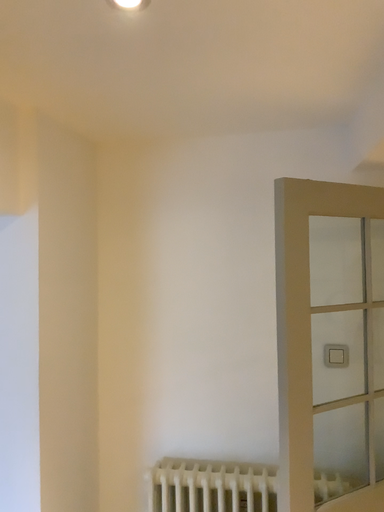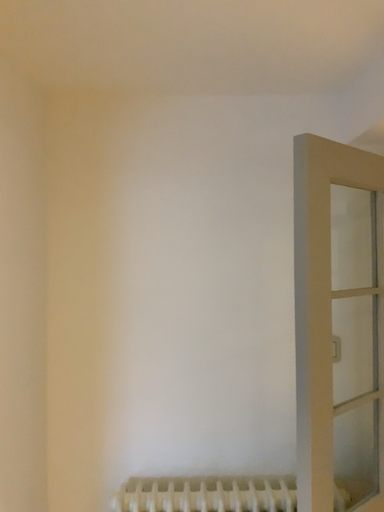
Question: Which way did the camera rotate in the video?

Choices:
 (A) rotated right
 (B) rotated left

Answer: (A)